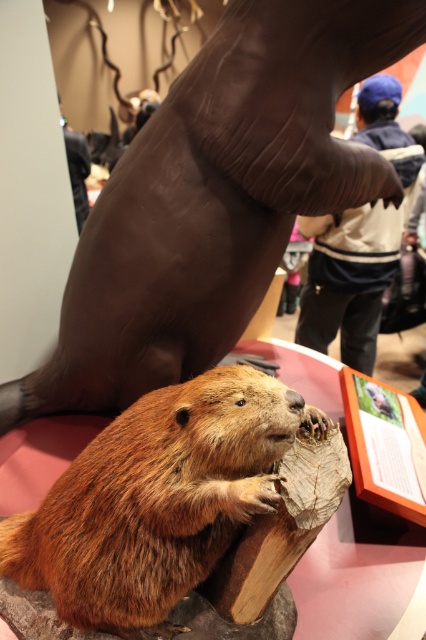
Is point (377, 212) closer to viewer compared to point (66, 145)?

Yes, point (377, 212) is closer to viewer.

Where is `blue knit cap at upper center`? This screenshot has height=640, width=426. blue knit cap at upper center is located at coordinates (359, 240).

Does brown furry beaver at center lie behind blue knit cap at upper center?

No.

Based on the photo, which is more to the right, brown furry beaver at center or blue knit cap at upper center?

Positioned to the right is blue knit cap at upper center.

Is point (132, 477) positioned behind point (374, 224)?

No, (132, 477) is closer to viewer.

Image resolution: width=426 pixels, height=640 pixels. Find the location of `brown furry beaver at center`. brown furry beaver at center is located at coordinates (157, 499).

Does point (241, 483) lie behind point (78, 189)?

No, (241, 483) is in front of (78, 189).

Locate an element on the screen. The image size is (426, 640). brown furry beaver at center is located at coordinates (157, 499).